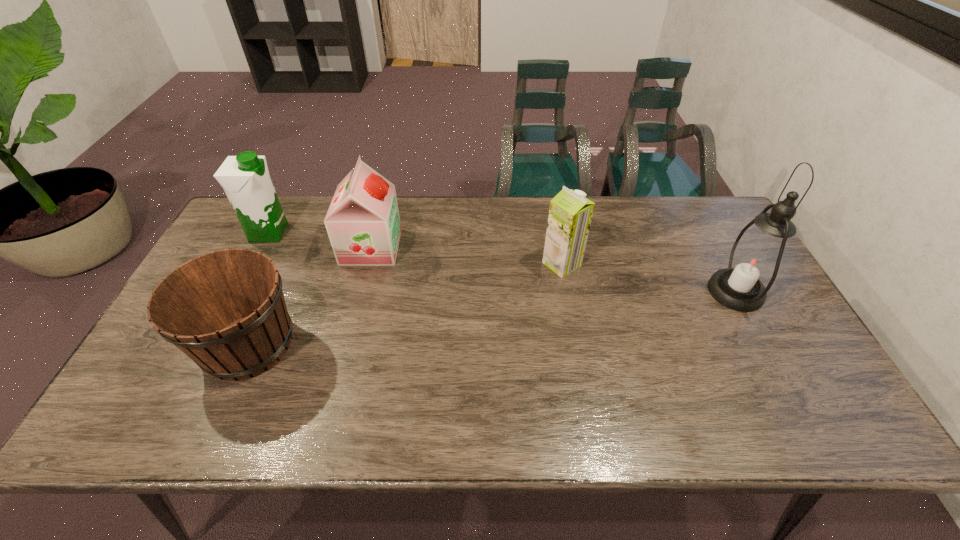
You are a GUI agent. You are given a task and a screenshot of the screen. Output one action in this format:
    pyautogui.click(x=<x>, y=<y>)
    Task: Click on the object that ranks as the fourth closest to the fourth object from left to right
    
    Given the screenshot: What is the action you would take?
    pyautogui.click(x=245, y=178)

Select which soya milk is the closest to the fourth object from left to right. Please provide its 2D coordinates. Your answer should be formatted as a tuple, i.e. [(x, y)], where the tuple contains the x and y coordinates of a point satisfying the conditions above.

[(363, 224)]

Identify the location of the closest soya milk to the oil lamp. (570, 214).

The width and height of the screenshot is (960, 540). Find the location of `vacant space that satisfies the following two spatial constraints: 1. on the front-facing side of the leftmost soya milk; 2. on the back side of the second object from right to left`. vacant space that satisfies the following two spatial constraints: 1. on the front-facing side of the leftmost soya milk; 2. on the back side of the second object from right to left is located at coordinates (252, 264).

At what (x,y) coordinates should I click in order to perform the action: click on vacant region that satisfies the following two spatial constraints: 1. with the cap open on the second object from right to left; 2. on the left side of the third object from left to right. Please return your answer as a coordinate pair (x, y). Looking at the image, I should click on (367, 264).

Where is `vacant space that satisfies the following two spatial constraints: 1. on the front-facing side of the leftmost soya milk; 2. on the left side of the tallest object`? Image resolution: width=960 pixels, height=540 pixels. vacant space that satisfies the following two spatial constraints: 1. on the front-facing side of the leftmost soya milk; 2. on the left side of the tallest object is located at coordinates (238, 292).

Where is `free spot that satisfies the following two spatial constraints: 1. on the back side of the wine bucket; 2. on the left side of the tallest object`? free spot that satisfies the following two spatial constraints: 1. on the back side of the wine bucket; 2. on the left side of the tallest object is located at coordinates (272, 292).

The height and width of the screenshot is (540, 960). I want to click on vacant space that satisfies the following two spatial constraints: 1. with the cap open on the third object from right to left; 2. on the back side of the tallest object, so click(x=359, y=292).

Where is `vacant area that satisfies the following two spatial constraints: 1. on the back side of the rightmost object; 2. with the cap open on the third object from right to left`? This screenshot has height=540, width=960. vacant area that satisfies the following two spatial constraints: 1. on the back side of the rightmost object; 2. with the cap open on the third object from right to left is located at coordinates (711, 247).

Where is `free spot that satisfies the following two spatial constraints: 1. on the front-facing side of the leftmost soya milk; 2. on the left side of the second object from right to left`? free spot that satisfies the following two spatial constraints: 1. on the front-facing side of the leftmost soya milk; 2. on the left side of the second object from right to left is located at coordinates (252, 264).